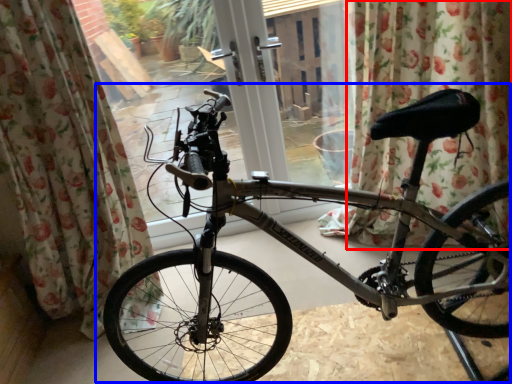
Question: Which object is further to the camera taking this photo, curtain (highlighted by a red box) or bicycle (highlighted by a blue box)?

Choices:
 (A) curtain
 (B) bicycle

Answer: (A)